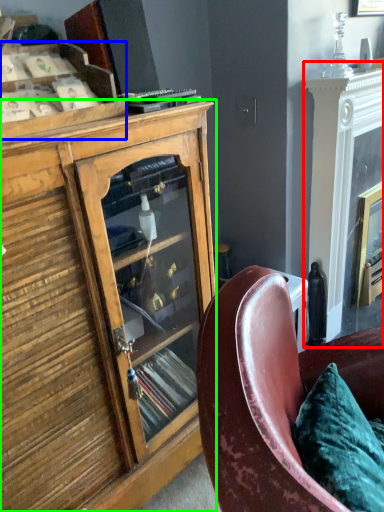
Question: Estimate the real-world distances between objects in this image. Which object is closer to fireplace (highlighted by a red box), shelf (highlighted by a blue box) or cabinetry (highlighted by a green box)?

Choices:
 (A) shelf
 (B) cabinetry

Answer: (B)